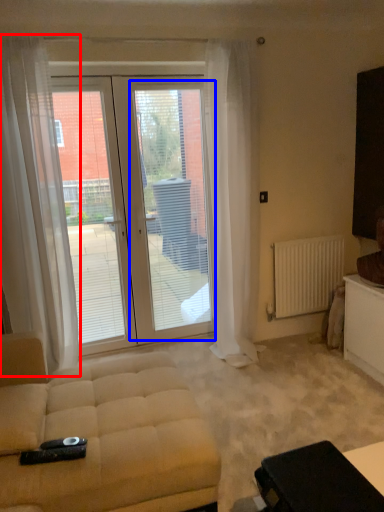
Question: Which object appears farthest to the camera in this image, curtain (highlighted by a red box) or screen door (highlighted by a blue box)?

Choices:
 (A) curtain
 (B) screen door

Answer: (B)